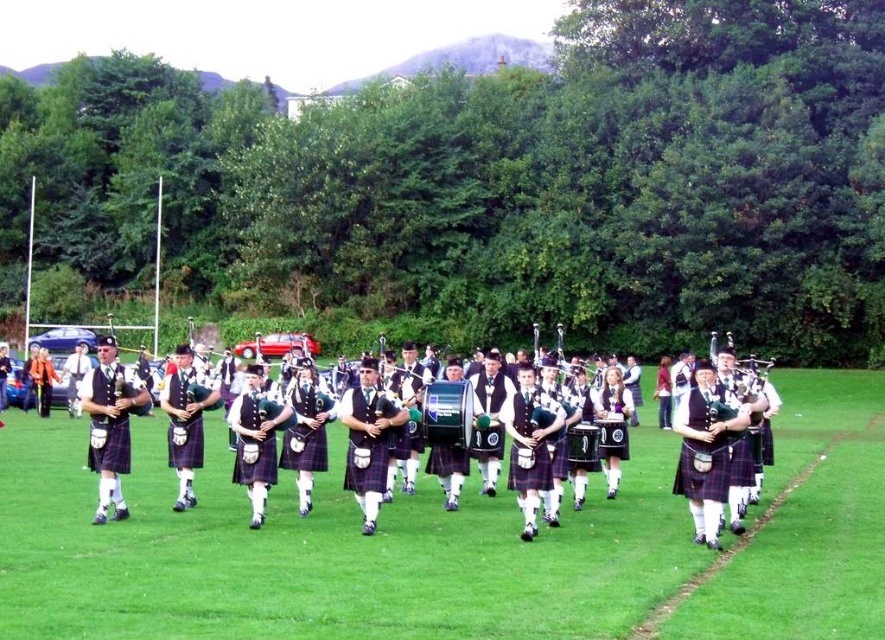
In the scene shown: You are a drone operator trying to capture the band members in the center of the image. The green grass at center is located at coordinates point. Where should you focus your camera to ensure you capture the band members in the center?

The green grass at center is located at point (325, 554), so you should focus your camera there to capture the band members in the center.

You are standing at the point marked by the coordinates point (105, 365). The band members are positioned in a semi circle formation in front of you. If you want to join the band, which direction should you move to reach the semi circle formation?

You should move towards the band members positioned in a semi circle formation in front of you.

You are a photographer standing at the origin point of the coordinate system. You want to capture a photo of the green grass at center located at point (325, 554). What is the exact coordinate of the green grass at center?

The green grass at center is located at point (325, 554).